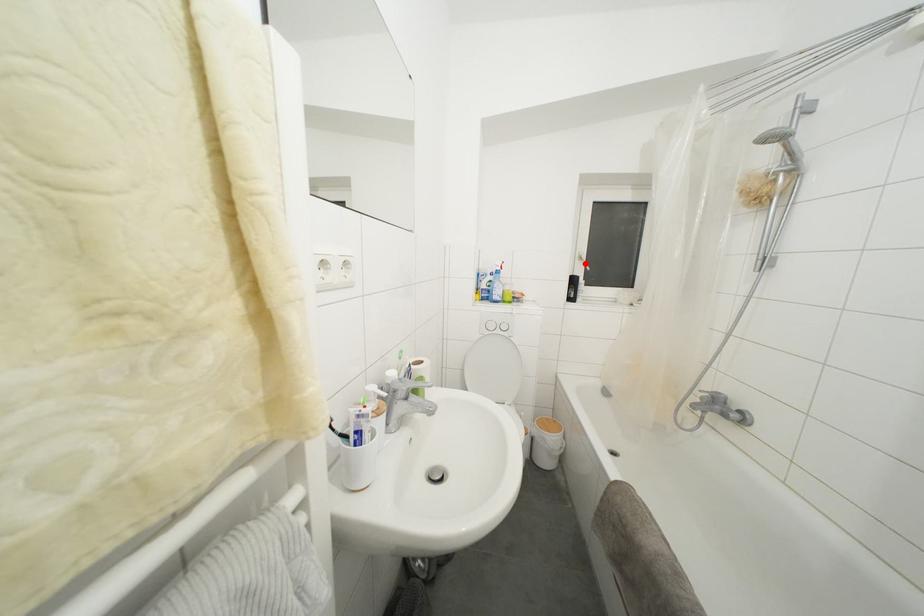
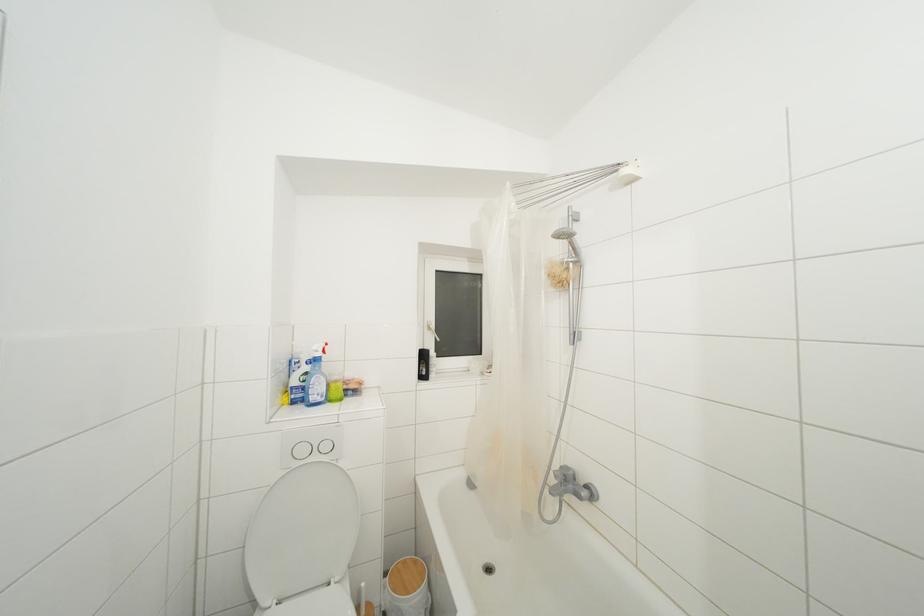
Question: A red point is marked in image1. In image2, is the corresponding 3D point closer to the camera or farther? Reply with the corresponding letter.

Choices:
 (A) The corresponding 3D point is closer.
 (B) The corresponding 3D point is farther.

Answer: (B)